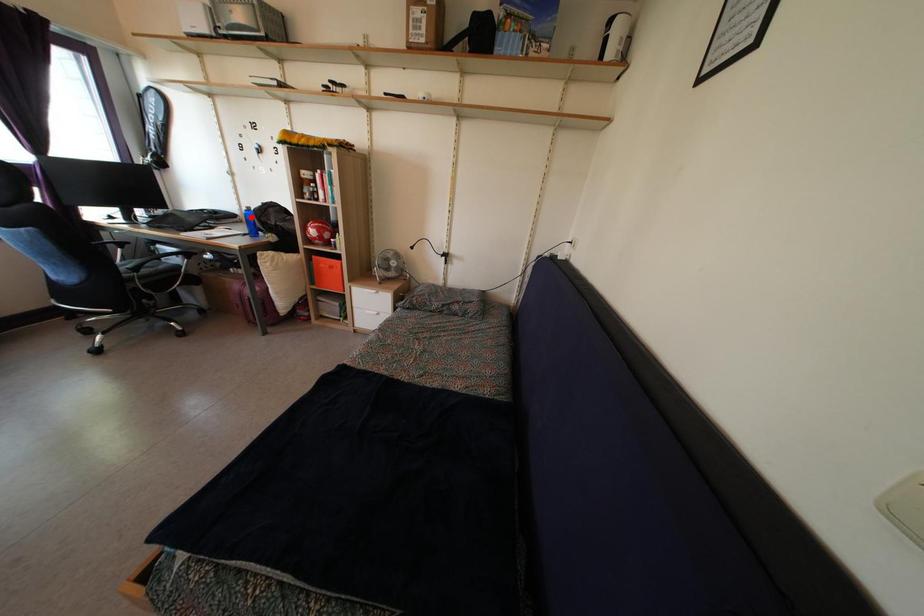
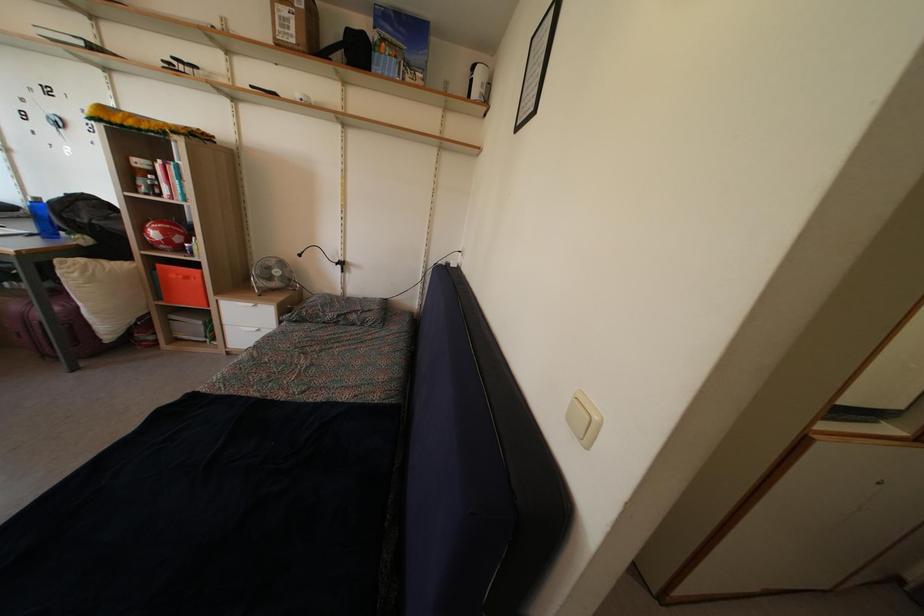
Question: I am providing you with two images of the same scene from different viewpoints. Given a red point in image1, look at the same physical point in image2. Is it:

Choices:
 (A) Closer to the viewpoint
 (B) Farther from the viewpoint

Answer: (B)